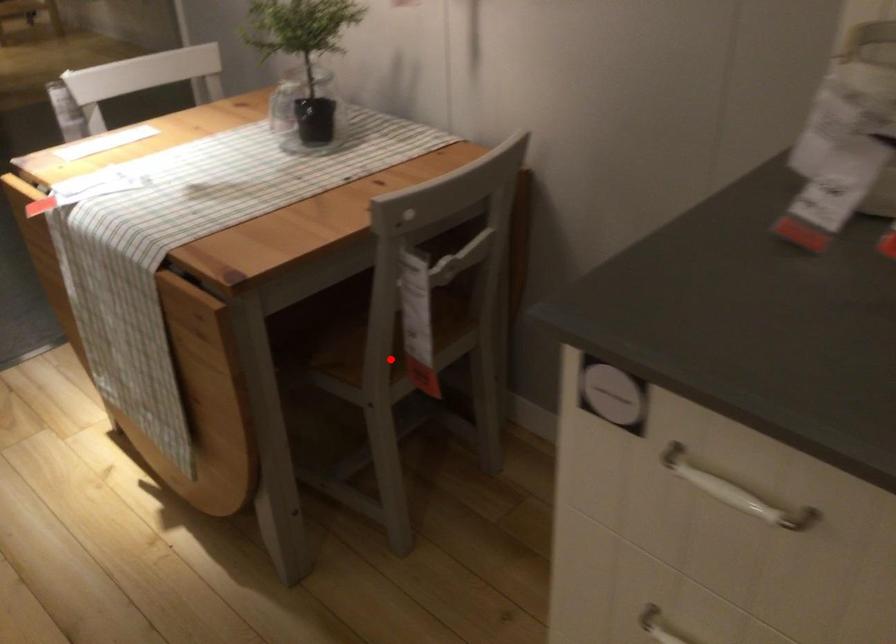
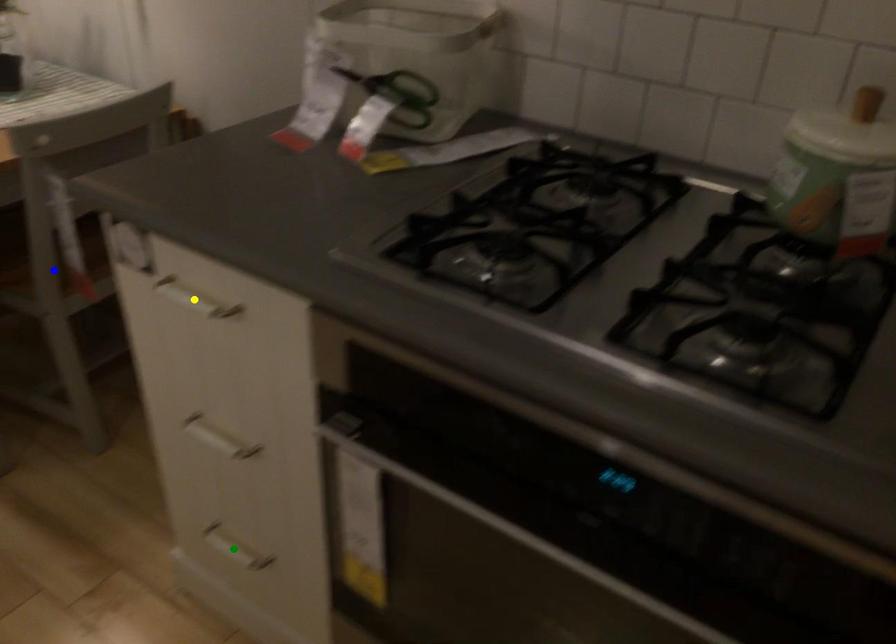
Question: I am providing you with two images of the same scene from different viewpoints. A red point is marked on the first image. You are given multiple points on the second image. Which point in image 2 is actually the same real-world point as the red point in image 1?

Choices:
 (A) green point
 (B) yellow point
 (C) blue point

Answer: (C)